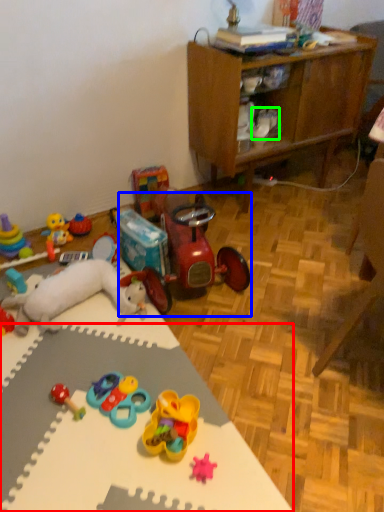
Question: Based on their relative distances, which object is nearer to desk (highlighted by a red box)? Choose from toy (highlighted by a blue box) and footwear (highlighted by a green box).

Choices:
 (A) toy
 (B) footwear

Answer: (A)